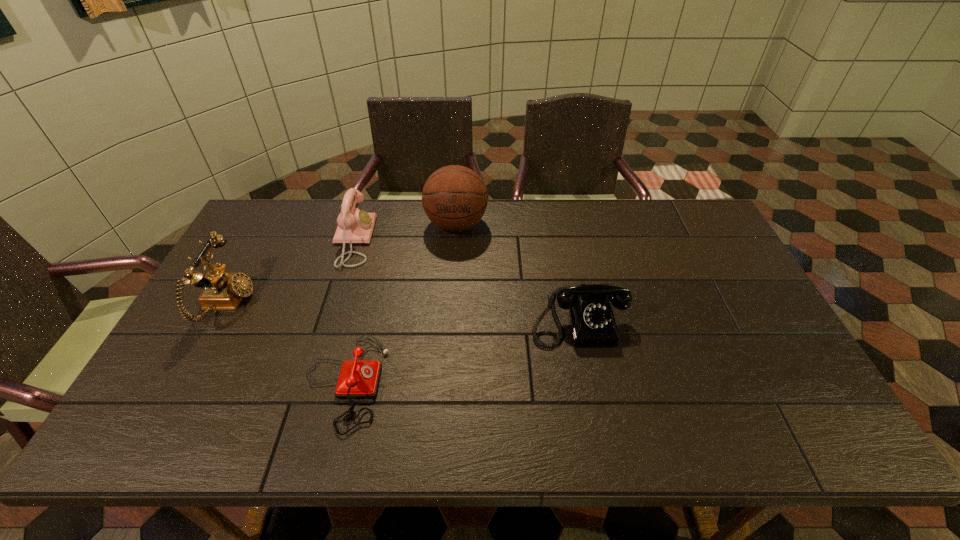
Identify the location of free spot located 0.260m on the dial of the rightmost telephone. (603, 447).

Identify the location of free space located on the dial of the shortest telephone. The image size is (960, 540). (429, 382).

Where is `basketball present at the far edge`? basketball present at the far edge is located at coordinates (454, 197).

This screenshot has width=960, height=540. In order to click on telephone that is positioned at the far edge in this screenshot , I will do `click(354, 226)`.

Identify the location of object situated at the near edge. This screenshot has height=540, width=960. (357, 379).

Locate an element on the screen. The height and width of the screenshot is (540, 960). object at the left edge is located at coordinates (221, 291).

The width and height of the screenshot is (960, 540). Find the location of `vacant space at the far edge of the desktop`. vacant space at the far edge of the desktop is located at coordinates (299, 233).

In the image, there is a desktop. Where is `vacant space at the near edge`? vacant space at the near edge is located at coordinates (573, 433).

The height and width of the screenshot is (540, 960). Find the location of `blank space at the left edge`. blank space at the left edge is located at coordinates (225, 355).

This screenshot has height=540, width=960. Identify the location of free space at the right edge of the desktop. (730, 284).